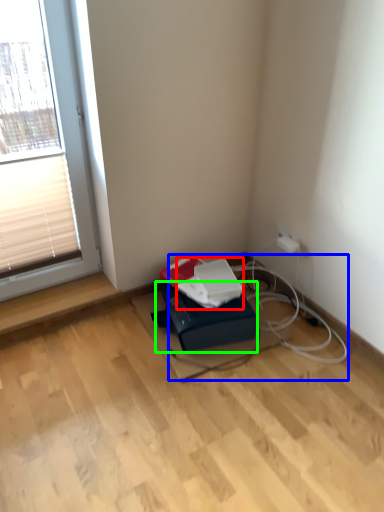
Question: Estimate the real-world distances between objects in this image. Which object is closer to paperback book (highlighted by a red box), cable (highlighted by a blue box) or cardboard box (highlighted by a green box)?

Choices:
 (A) cable
 (B) cardboard box

Answer: (B)